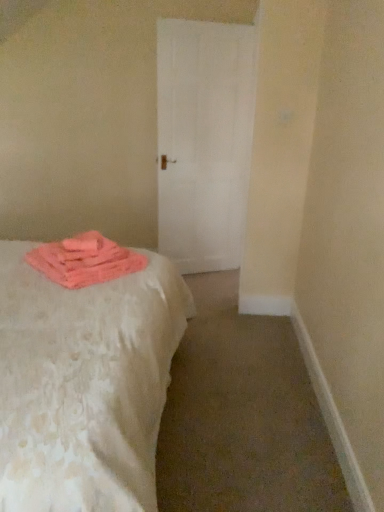
Question: Is white matte door at center beside pink fluffy towel at lower left?

Choices:
 (A) yes
 (B) no

Answer: (B)

Question: Is white matte door at center positioned with its back to pink fluffy towel at lower left?

Choices:
 (A) yes
 (B) no

Answer: (B)

Question: Does white matte door at center come in front of pink fluffy towel at lower left?

Choices:
 (A) no
 (B) yes

Answer: (A)

Question: Does white matte door at center have a smaller size compared to pink fluffy towel at lower left?

Choices:
 (A) no
 (B) yes

Answer: (A)

Question: Would you say pink fluffy towel at lower left is part of white matte door at center's contents?

Choices:
 (A) yes
 (B) no

Answer: (B)

Question: Is white matte door at center bigger or smaller than white textured bed at left?

Choices:
 (A) small
 (B) big

Answer: (A)

Question: From the image's perspective, is white matte door at center located above or below white textured bed at left?

Choices:
 (A) below
 (B) above

Answer: (B)

Question: In the image, is white matte door at center positioned in front of or behind white textured bed at left?

Choices:
 (A) front
 (B) behind

Answer: (B)

Question: Do you think white matte door at center is within white textured bed at left, or outside of it?

Choices:
 (A) outside
 (B) inside

Answer: (A)

Question: Considering the positions of pink fluffy towel at lower left and white textured bed at left in the image, is pink fluffy towel at lower left bigger or smaller than white textured bed at left?

Choices:
 (A) small
 (B) big

Answer: (A)

Question: Is point (125, 249) closer or farther from the camera than point (67, 458)?

Choices:
 (A) closer
 (B) farther

Answer: (B)

Question: From the image's perspective, is pink fluffy towel at lower left located above or below white textured bed at left?

Choices:
 (A) below
 (B) above

Answer: (B)

Question: Considering their positions, is pink fluffy towel at lower left located in front of or behind white textured bed at left?

Choices:
 (A) behind
 (B) front

Answer: (A)

Question: In the image, is white textured bed at left on the left side or the right side of white matte door at center?

Choices:
 (A) left
 (B) right

Answer: (A)

Question: From the image's perspective, is white textured bed at left located above or below white matte door at center?

Choices:
 (A) above
 (B) below

Answer: (B)